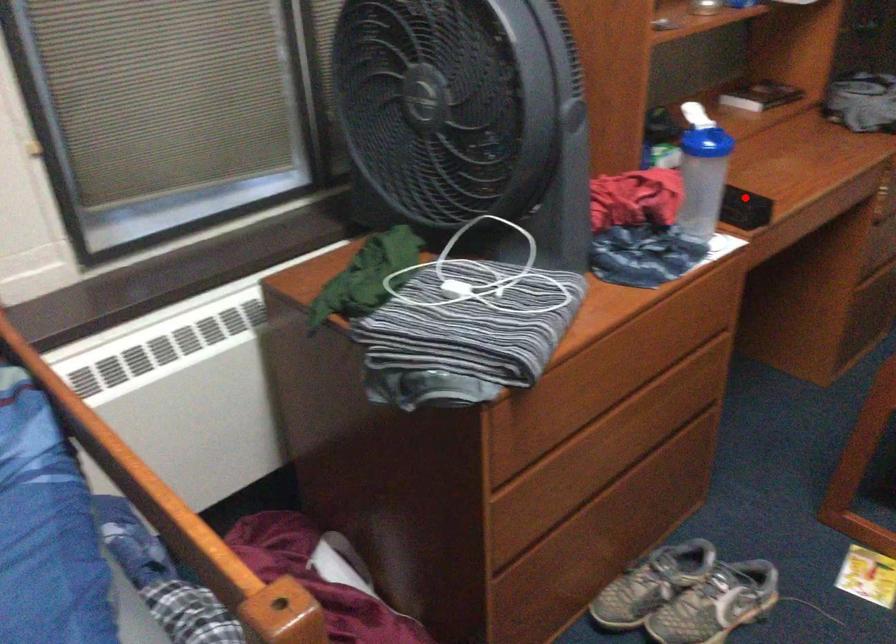
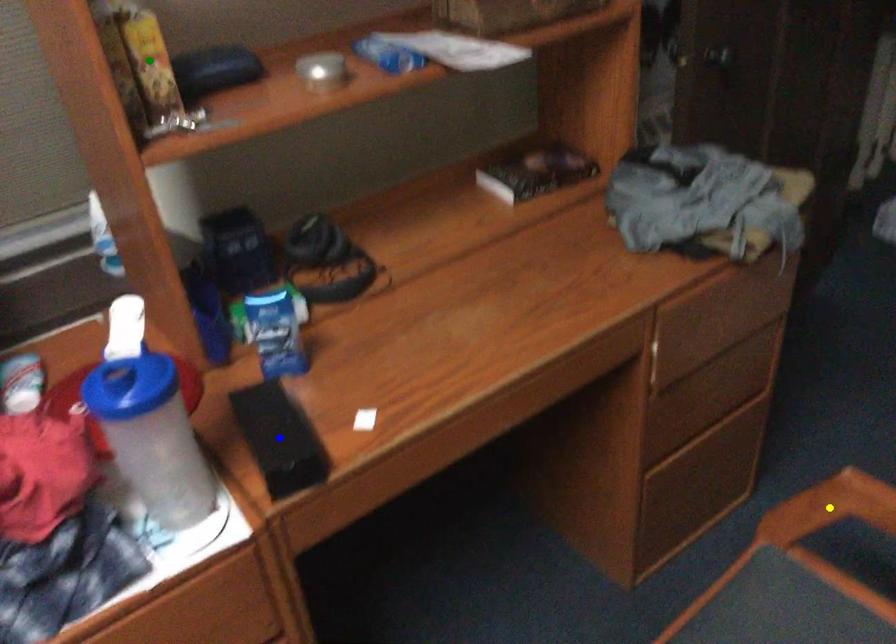
Question: I am providing you with two images of the same scene from different viewpoints. A red point is marked on the first image. You are given multiple points on the second image. Can you choose the point in image 2 that corresponds to the point in image 1?

Choices:
 (A) green point
 (B) yellow point
 (C) blue point

Answer: (C)